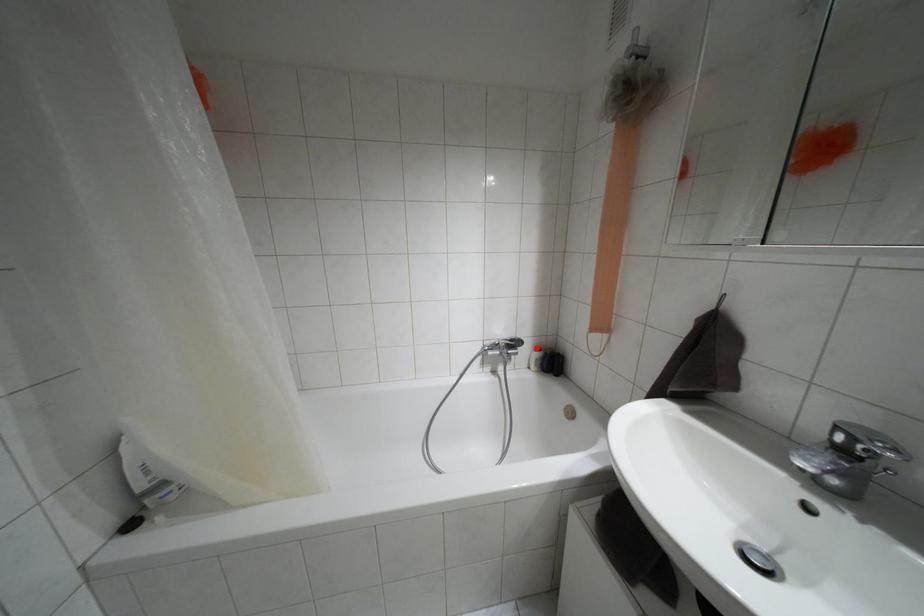
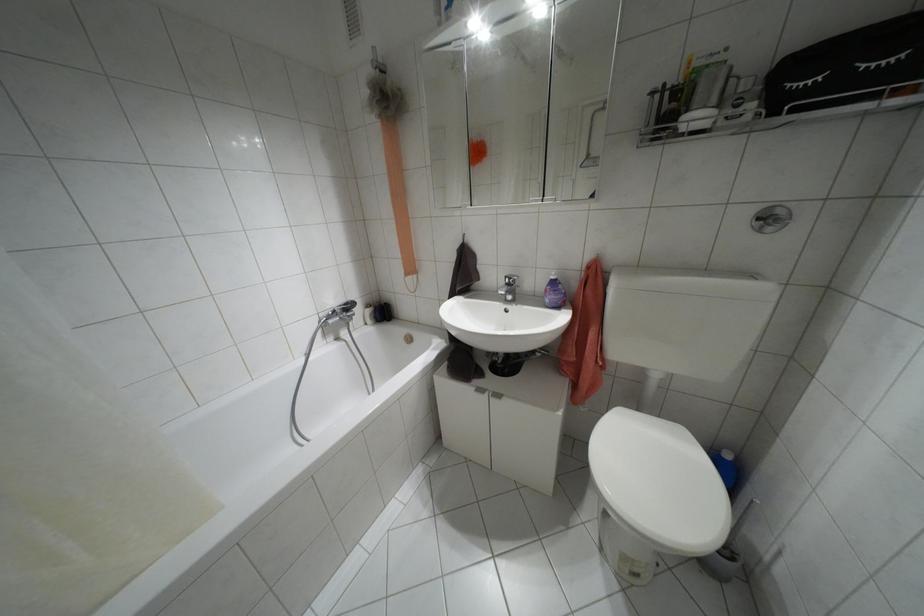
Question: I am providing you with two images of the same scene from different viewpoints. In image1, a red point is highlighted. Considering the same 3D point in image2, which of the following is correct?

Choices:
 (A) It is closer
 (B) It is farther

Answer: (A)